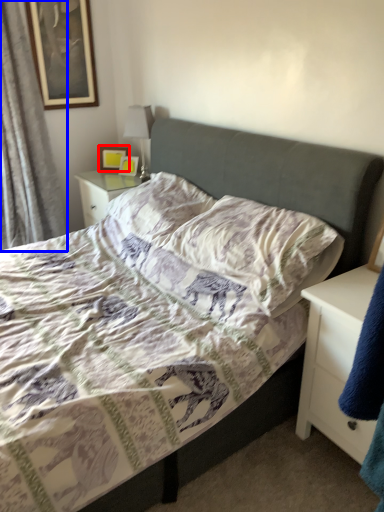
Question: Which object appears closest to the camera in this image, picture frame (highlighted by a red box) or curtain (highlighted by a blue box)?

Choices:
 (A) picture frame
 (B) curtain

Answer: (B)